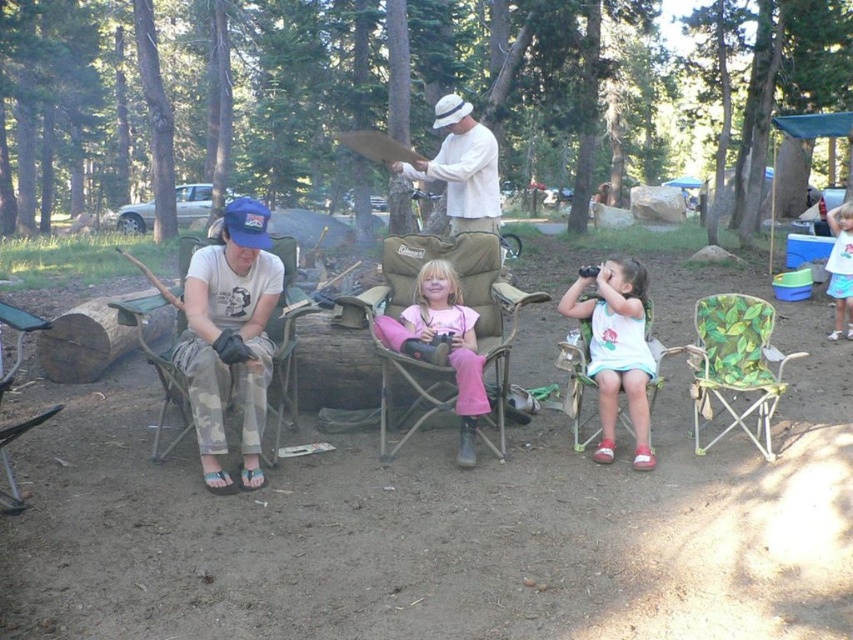
From the picture: You are a photographer setting up a shot of the campsite scene. You want to ensure that both the pink fabric pants at center and the camouflage fabric chair at left are clearly visible in the frame. Given their positions, which object should you focus on first to ensure both are in focus?

The camouflage fabric chair at left is behind the pink fabric pants at center, so you should focus on the camouflage fabric chair at left first to ensure both are in focus.

You are standing at the campsite and want to place a small flag at point A and point B. Point A is at coordinates point [397,349] and point B is at coordinates point [154,360]. Which point is closer to you?

Point A at coordinates point [397,349] is closer to you because it is further to the viewer than point B at coordinates point [154,360].